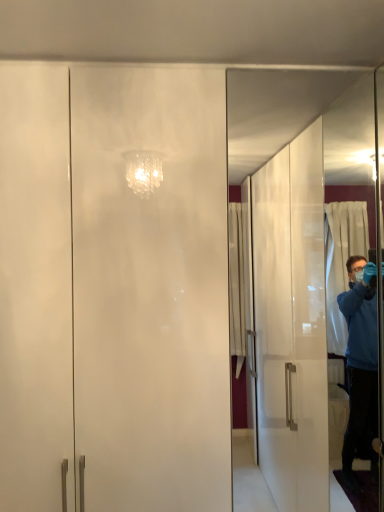
Question: Is transparent glass screen door at right, placed as the first screen door when sorted from right to left, taller or shorter than frosted glass cabinet at center, the second screen door when ordered from back to front?

Choices:
 (A) short
 (B) tall

Answer: (A)

Question: In the image, is transparent glass screen door at right, placed as the first screen door when sorted from right to left, positioned in front of or behind frosted glass cabinet at center, the 1th screen door viewed from the left?

Choices:
 (A) behind
 (B) front

Answer: (A)

Question: Is point (329, 426) closer or farther from the camera than point (215, 253)?

Choices:
 (A) farther
 (B) closer

Answer: (A)

Question: Is frosted glass cabinet at center, the 1th screen door viewed from the left, taller or shorter than transparent glass screen door at right, the first screen door in the back-to-front sequence?

Choices:
 (A) tall
 (B) short

Answer: (A)

Question: Considering the positions of frosted glass cabinet at center, the second screen door when ordered from back to front, and transparent glass screen door at right, placed as the first screen door when sorted from right to left, in the image, is frosted glass cabinet at center, the second screen door when ordered from back to front, wider or thinner than transparent glass screen door at right, placed as the first screen door when sorted from right to left,?

Choices:
 (A) thin
 (B) wide

Answer: (B)

Question: From the image's perspective, is frosted glass cabinet at center, the 1th screen door viewed from the left, positioned above or below transparent glass screen door at right, placed as the first screen door when sorted from right to left?

Choices:
 (A) below
 (B) above

Answer: (A)

Question: From a real-world perspective, is frosted glass cabinet at center, the second screen door when ordered from back to front, physically located above or below transparent glass screen door at right, which is the second screen door from left to right?

Choices:
 (A) above
 (B) below

Answer: (B)